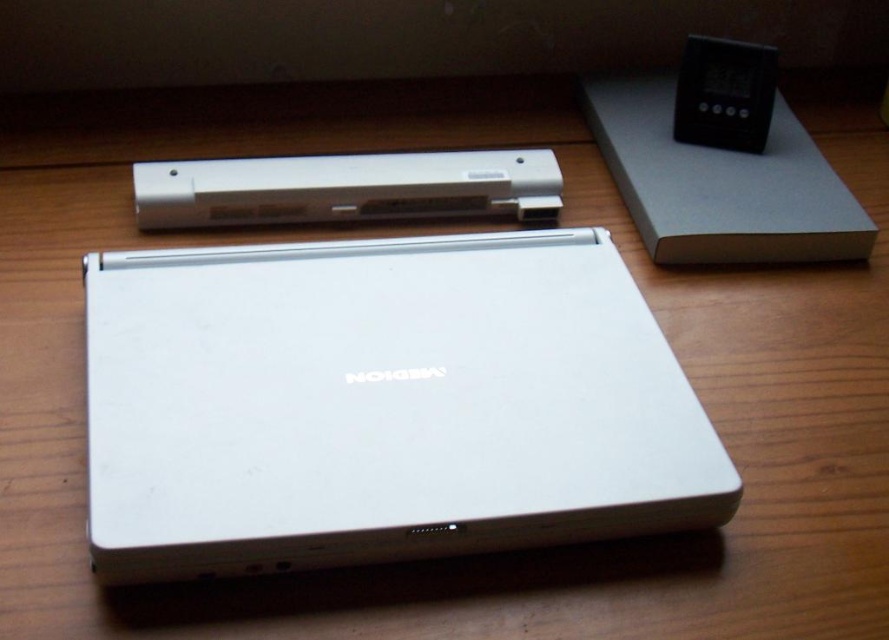
In the scene shown: You are setting up a music system in your room. You have a white plastic speaker at upper center and a black plastic ipod at upper right. Which device should you place on the shelf if you want the taller one to be visible from a distance?

The black plastic ipod at upper right is taller than the white plastic speaker at upper center, so you should place the black plastic ipod at upper right on the shelf to make the taller one visible from a distance.

You are organizing your desk and want to place a new object between the white matte laptop at center and the black plastic ipod at upper right. Can you do this without moving either of them?

The white matte laptop at center is in front of the black plastic ipod at upper right, so there is no space between them for placing a new object without moving either of them.

From the picture: You want to place both the white matte laptop at center and the black plastic ipod at upper right on a shelf that can only hold items up to 20 cm in width. Which item should you place first to ensure both fit?

The black plastic ipod at upper right is narrower than the white matte laptop at center. Place the wider white matte laptop at center first, then the narrower black plastic ipod at upper right to ensure both fit within the 20 cm width limit.